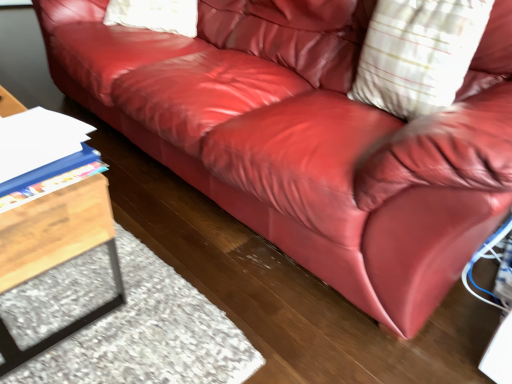
Question: Do you think blue plastic folder at lower left is within wooden table at left, or outside of it?

Choices:
 (A) outside
 (B) inside

Answer: (A)

Question: Is point (10, 144) closer or farther from the camera than point (80, 188)?

Choices:
 (A) farther
 (B) closer

Answer: (B)

Question: Estimate the real-world distances between objects in this image. Which object is closer to the white striped pillow at upper right?

Choices:
 (A) wooden table at left
 (B) blue plastic folder at lower left

Answer: (B)

Question: Which object is positioned closest to the blue plastic folder at lower left?

Choices:
 (A) wooden table at left
 (B) white striped pillow at upper right

Answer: (A)